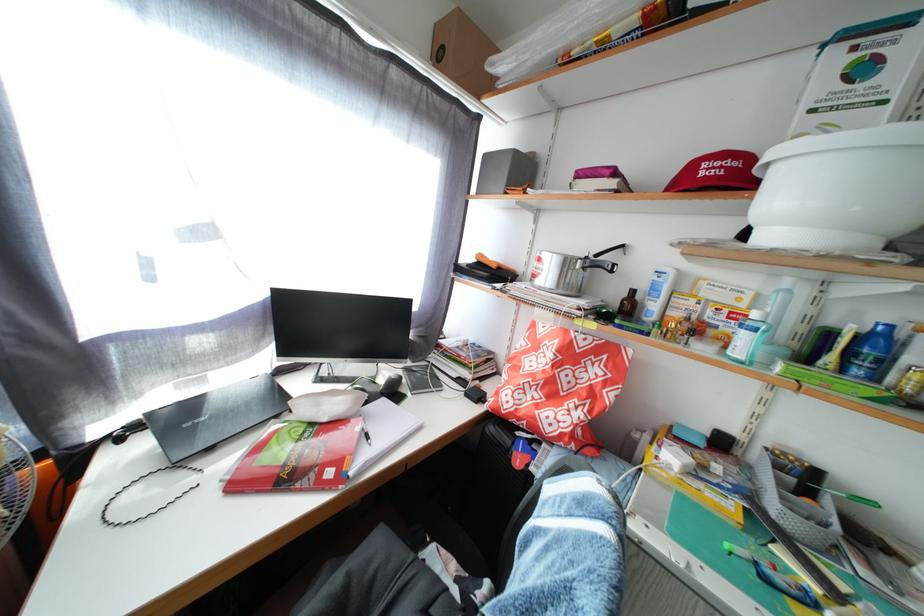
The image size is (924, 616). What are the coordinates of `black computer mouse` in the screenshot? It's located at (391, 385).